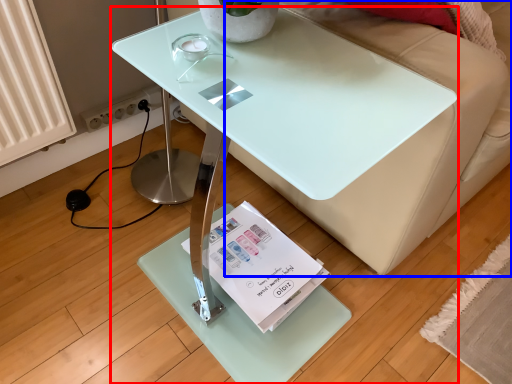
Question: Which object appears farthest to the camera in this image, table (highlighted by a red box) or couch (highlighted by a blue box)?

Choices:
 (A) table
 (B) couch

Answer: (B)